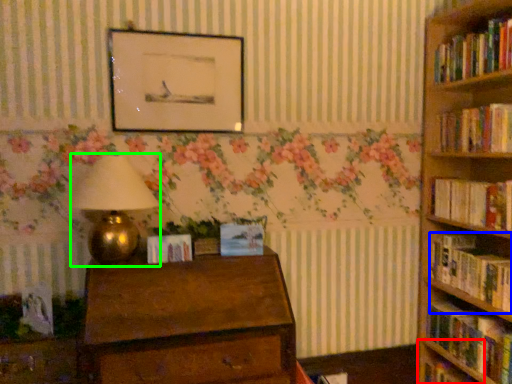
Question: Estimate the real-world distances between objects in this image. Which object is closer to shelf (highlighted by a red box), book (highlighted by a blue box) or table lamp (highlighted by a green box)?

Choices:
 (A) book
 (B) table lamp

Answer: (A)